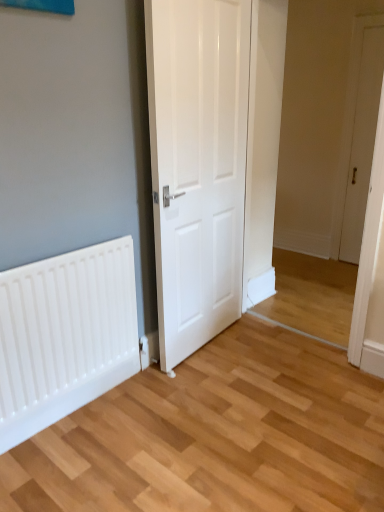
Question: Is white glossy door at center, the 1th door positioned from the left, bigger than white matte radiator at lower left?

Choices:
 (A) no
 (B) yes

Answer: (B)

Question: Can you confirm if white glossy door at center, the second door positioned from the right, is wider than white matte radiator at lower left?

Choices:
 (A) no
 (B) yes

Answer: (B)

Question: From the image's perspective, is white glossy door at center, the 2th door in the back-to-front sequence, below white matte radiator at lower left?

Choices:
 (A) no
 (B) yes

Answer: (A)

Question: From a real-world perspective, does white glossy door at center, the 1th door positioned from the left, stand above white matte radiator at lower left?

Choices:
 (A) no
 (B) yes

Answer: (B)

Question: From a real-world perspective, is white glossy door at center, positioned as the first door in front-to-back order, beneath white matte radiator at lower left?

Choices:
 (A) yes
 (B) no

Answer: (B)

Question: From a real-world perspective, is white wooden door at right, positioned as the first door in back-to-front order, physically located above or below white glossy door at center, the 2th door in the back-to-front sequence?

Choices:
 (A) above
 (B) below

Answer: (A)

Question: Considering the positions of white wooden door at right, positioned as the first door in back-to-front order, and white glossy door at center, positioned as the first door in front-to-back order, in the image, is white wooden door at right, positioned as the first door in back-to-front order, wider or thinner than white glossy door at center, positioned as the first door in front-to-back order,?

Choices:
 (A) wide
 (B) thin

Answer: (B)

Question: Considering the relative positions of white wooden door at right, the 1th door viewed from the right, and white glossy door at center, positioned as the first door in front-to-back order, in the image provided, is white wooden door at right, the 1th door viewed from the right, to the left or to the right of white glossy door at center, positioned as the first door in front-to-back order,?

Choices:
 (A) left
 (B) right

Answer: (B)

Question: From the image's perspective, is white wooden door at right, positioned as the first door in back-to-front order, located above or below white glossy door at center, the second door positioned from the right?

Choices:
 (A) above
 (B) below

Answer: (A)

Question: Relative to white matte radiator at lower left, is white wooden door at right, the 1th door viewed from the right, in front or behind?

Choices:
 (A) behind
 (B) front

Answer: (A)

Question: From the image's perspective, relative to white matte radiator at lower left, is white wooden door at right, which ranks as the second door in left-to-right order, above or below?

Choices:
 (A) above
 (B) below

Answer: (A)

Question: Considering the positions of point (362, 206) and point (43, 386), is point (362, 206) closer or farther from the camera than point (43, 386)?

Choices:
 (A) closer
 (B) farther

Answer: (B)

Question: From a real-world perspective, is white wooden door at right, positioned as the first door in back-to-front order, physically located above or below white matte radiator at lower left?

Choices:
 (A) below
 (B) above

Answer: (B)

Question: Is white glossy door at center, the 2th door in the back-to-front sequence, to the left or to the right of white wooden door at right, the second door from the front, in the image?

Choices:
 (A) right
 (B) left

Answer: (B)

Question: Looking at their shapes, would you say white glossy door at center, positioned as the first door in front-to-back order, is wider or thinner than white wooden door at right, the 1th door viewed from the right?

Choices:
 (A) thin
 (B) wide

Answer: (B)